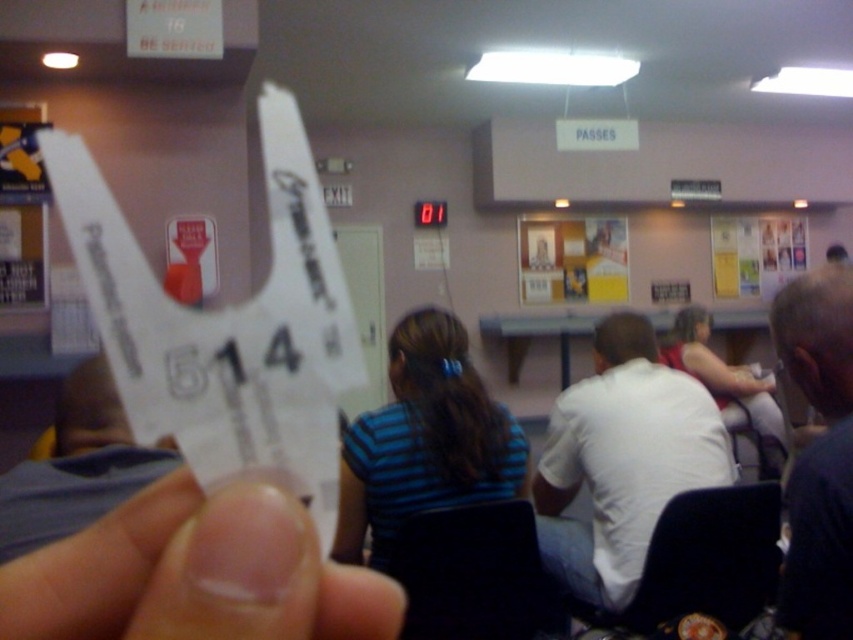
You are standing in a waiting area and holding a white paper at center. If you want to hand it to someone who is 6 feet away from you, will you be able to reach them without moving closer?

The distance between you and the white paper at center is 7.81 inches, so you can reach someone 6 feet away because 6 feet is much farther than 7.81 inches. Wait, that doesn,t make sense. Let me recalculate. Hmm, 7.81 inches is about 0.65 feet. Since the person is 6 feet away, which is significantly farther than the distance to the paper, you would need to move closer to hand it over. Therefore, no, you cannot reach them without moving closer.

You are a customer at a service counter and see two people in front of you. They are wearing a white matte shirt at center and a blue striped shirt at center. Which shirt is closer to you?

The white matte shirt at center is closer to you because it is positioned further to the viewer than the blue striped shirt at center.

You are a person standing in the waiting area and you want to know if you can fit a 12 inch wide bag between the white matte shirt at center and the blue striped shirt at center. Can you fit it?

The distance between the white matte shirt at center and the blue striped shirt at center is 15.32 inches, which is wider than the 12 inch bag. Therefore, the bag can fit between them.